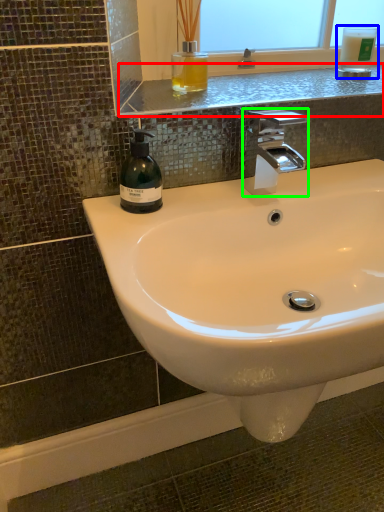
Question: Which object is positioned farthest from window sill (highlighted by a red box)? Select from mouthwash (highlighted by a blue box) and tap (highlighted by a green box).

Choices:
 (A) mouthwash
 (B) tap

Answer: (A)